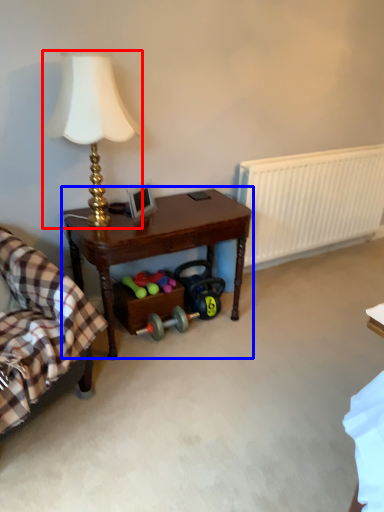
Question: Among these objects, which one is nearest to the camera, lamp (highlighted by a red box) or table (highlighted by a blue box)?

Choices:
 (A) lamp
 (B) table

Answer: (A)